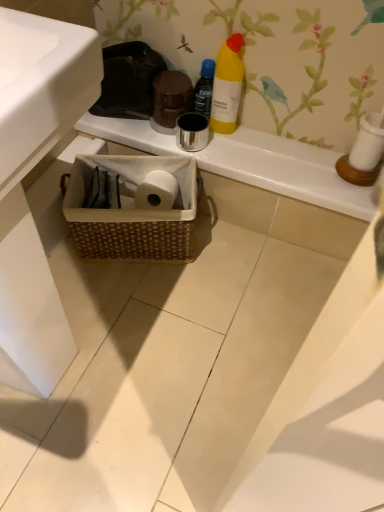
Question: Would you say woven brown basket at lower center is a long distance from white glossy sink at lower left?

Choices:
 (A) no
 (B) yes

Answer: (A)

Question: From the image's perspective, is woven brown basket at lower center over white glossy sink at lower left?

Choices:
 (A) no
 (B) yes

Answer: (B)

Question: Can you confirm if woven brown basket at lower center is positioned to the right of white glossy sink at lower left?

Choices:
 (A) no
 (B) yes

Answer: (B)

Question: Is woven brown basket at lower center at the left side of white glossy sink at lower left?

Choices:
 (A) yes
 (B) no

Answer: (B)

Question: Is woven brown basket at lower center further to camera compared to white glossy sink at lower left?

Choices:
 (A) no
 (B) yes

Answer: (B)

Question: In the image, is white glossy sink at lower left on the left side or the right side of woven basket at center?

Choices:
 (A) left
 (B) right

Answer: (A)

Question: Is white glossy sink at lower left bigger or smaller than woven basket at center?

Choices:
 (A) big
 (B) small

Answer: (A)

Question: From the image's perspective, is white glossy sink at lower left above or below woven basket at center?

Choices:
 (A) below
 (B) above

Answer: (A)

Question: Is white glossy sink at lower left situated inside woven basket at center or outside?

Choices:
 (A) inside
 (B) outside

Answer: (B)

Question: Choose the correct answer: Is white glossy sink at lower left inside woven brown basket at lower center or outside it?

Choices:
 (A) inside
 (B) outside

Answer: (B)

Question: Is white glossy sink at lower left in front of or behind woven brown basket at lower center in the image?

Choices:
 (A) front
 (B) behind

Answer: (A)

Question: From the image's perspective, is white glossy sink at lower left located above or below woven brown basket at lower center?

Choices:
 (A) above
 (B) below

Answer: (B)

Question: From their relative heights in the image, would you say white glossy sink at lower left is taller or shorter than woven brown basket at lower center?

Choices:
 (A) tall
 (B) short

Answer: (A)

Question: From a real-world perspective, is woven basket at center above or below yellow matte bottle at upper center, positioned as the second bottle in right-to-left order?

Choices:
 (A) above
 (B) below

Answer: (B)

Question: Considering the positions of woven basket at center and yellow matte bottle at upper center, the first bottle when ordered from left to right, in the image, is woven basket at center wider or thinner than yellow matte bottle at upper center, the first bottle when ordered from left to right,?

Choices:
 (A) thin
 (B) wide

Answer: (B)